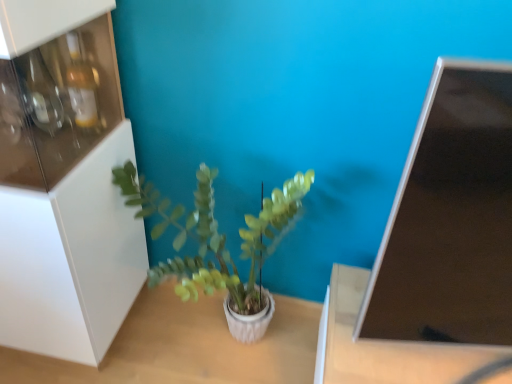
Question: Based on their sizes in the image, would you say white glossy cabinet at left is bigger or smaller than green matte plant at center?

Choices:
 (A) big
 (B) small

Answer: (A)

Question: From the image's perspective, is white glossy cabinet at left located above or below green matte plant at center?

Choices:
 (A) below
 (B) above

Answer: (B)

Question: Which is nearer to the green matte plant at center?

Choices:
 (A) matte black monitor at upper right
 (B) white textured table at center, which is counted as the 2th table, starting from the right
 (C) brown matte table at lower right, which is counted as the second table, starting from the left
 (D) white glossy cabinet at left

Answer: (D)

Question: Considering the real-world distances, which object is farthest from the brown matte table at lower right, which is the first table in right-to-left order?

Choices:
 (A) matte black monitor at upper right
 (B) white textured table at center, which is counted as the 2th table, starting from the right
 (C) white glossy cabinet at left
 (D) green matte plant at center

Answer: (C)